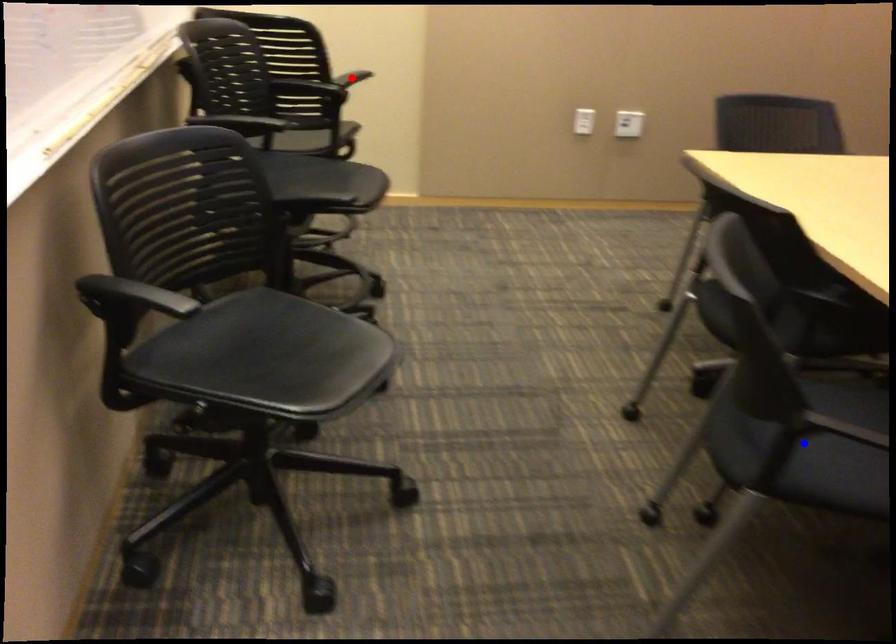
Question: In the image, two points are highlighted. Which point is nearer to the camera? Reply with the corresponding letter.

Choices:
 (A) blue point
 (B) red point

Answer: (A)